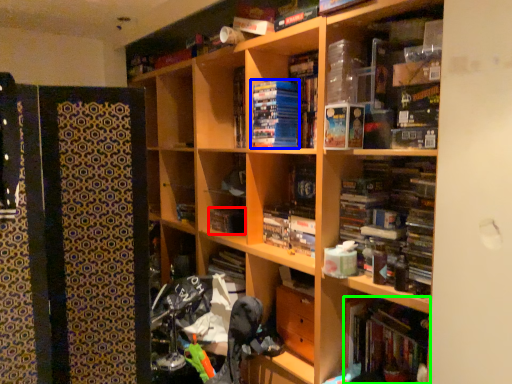
Question: Considering the real-world distances, which object is farthest from book (highlighted by a red box)? paperback book (highlighted by a blue box) or book (highlighted by a green box)?

Choices:
 (A) paperback book
 (B) book

Answer: (B)